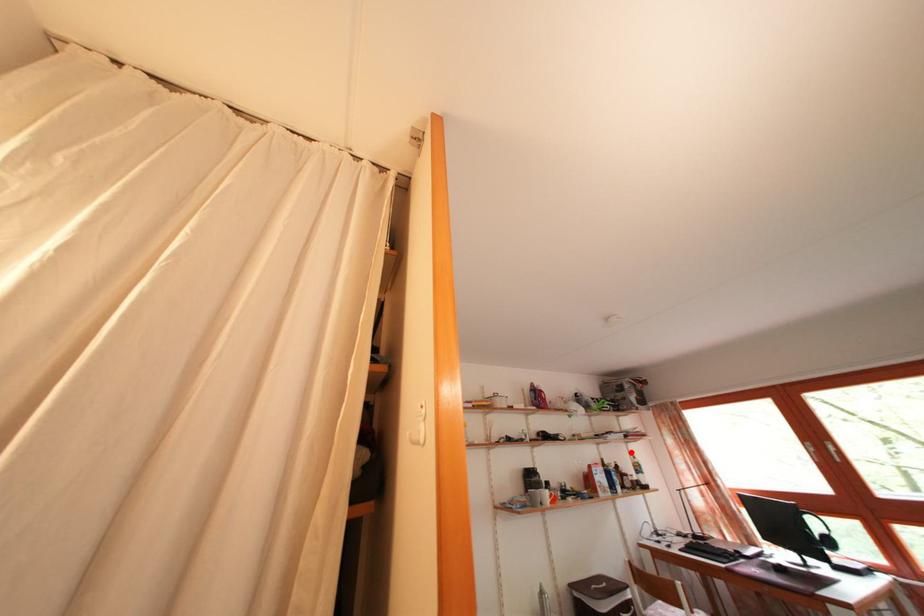
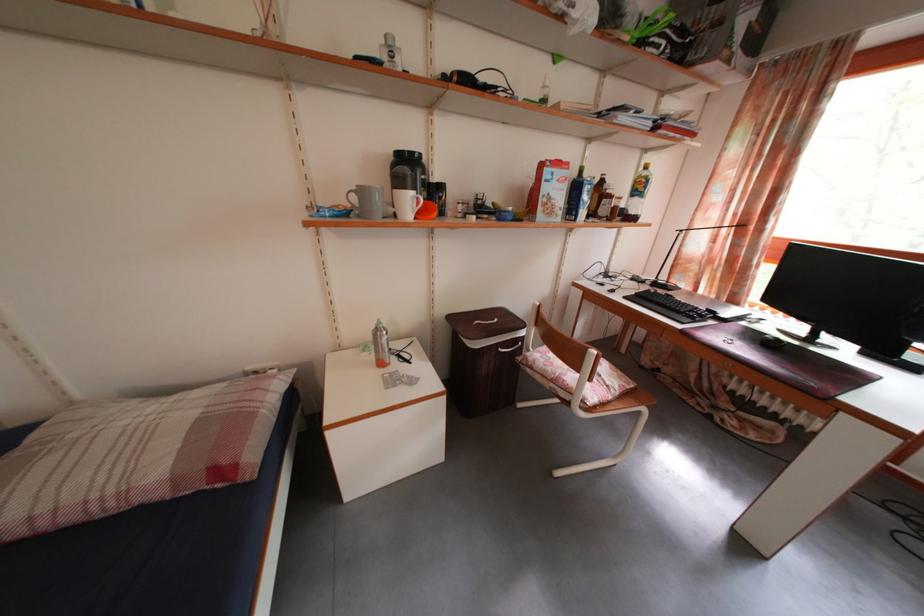
Question: I am providing you with two images of the same scene from different viewpoints. A red point is marked on the first image. Is the red point's position out of view in image 2?

Choices:
 (A) Yes
 (B) No

Answer: (B)